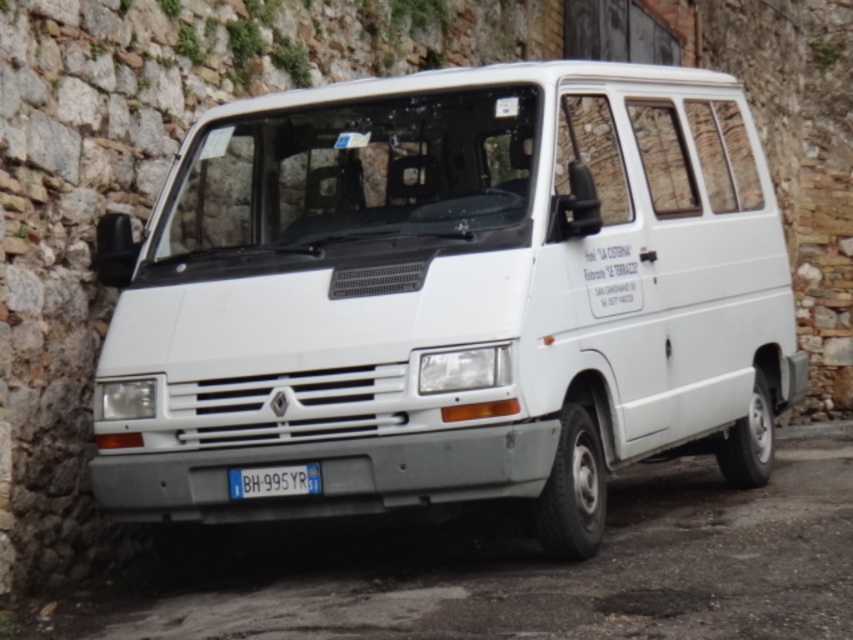
You are a delivery driver who needs to park your white matte van at center under a low clearance bridge. The bridge has a height restriction of 2 meters. Given that the blue metallic license plate at center is positioned at 1.5 meters from the ground, can you safely pass under the bridge with your van?

The white matte van at center is much taller than the blue metallic license plate at center, which is at 1.5 meters from the ground. Since the van is taller than the license plate, its height likely exceeds the 2 meter bridge clearance, so it may not pass safely.

You are a delivery driver who needs to attach a GPS tracker to the blue metallic license plate at center of your white matte van at center. The GPS tracker has a maximum range of 1.5 meters. Can you attach it without moving the tracker beyond its range?

The distance between the white matte van at center and the blue metallic license plate at center is 1.64 meters. Since the GPS tracker has a maximum range of 1.5 meters, it cannot reach the license plate without exceeding its range.

You are a delivery driver who needs to park your white matte van at center in a space that requires the license plate to be visible from the front. Based on the image, will the blue metallic license plate at center be visible when the van is parked as required?

The white matte van at center is positioned on the right side of the blue metallic license plate at center, so when parked, the license plate will be visible from the front as it is placed to the left of the van.